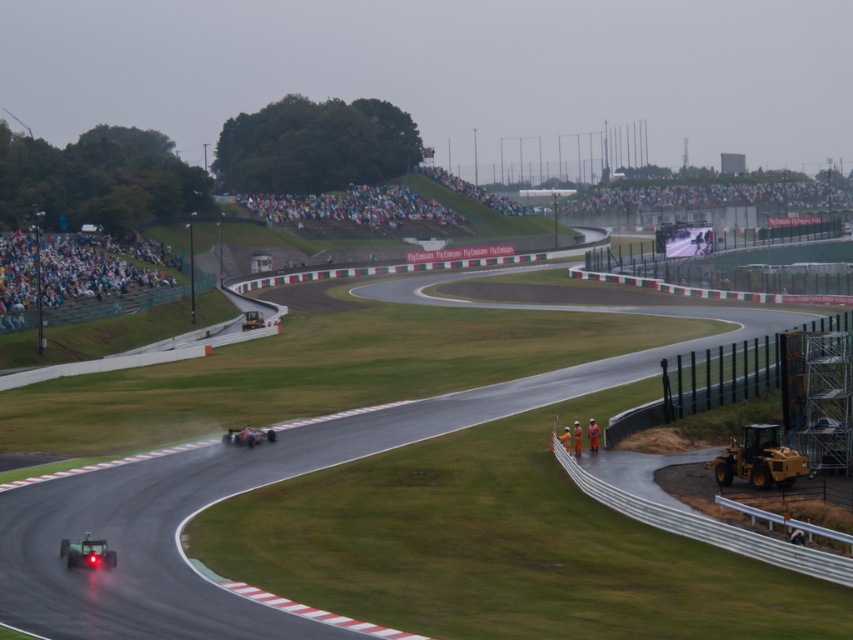
You are a race car driver preparing to enter the smooth asphalt race track at center from the yellow metallic race car at lower right. Considering the track and car widths, can your car safely navigate the track without touching the edges?

The smooth asphalt race track at center is wider than the yellow metallic race car at lower right, so yes, the car can safely navigate the track without touching the edges.

You are a race car driver who just passed the yellow metallic race car at lower right. You want to know if you can safely overtake the next car ahead on the smooth asphalt race track at center. Given that your car requires at least 30 feet of clear track to perform a safe overtake, can you do it?

The distance between the yellow metallic race car at lower right and the smooth asphalt race track at center is 33.76 feet, which is more than the required 30 feet. Therefore, you can safely overtake the next car ahead on the smooth asphalt race track at center.

You are a race car driver preparing for a pit stop. You need to know if your shiny metallic race car at center can fit entirely on the smooth asphalt race track at center without any part hanging off. Based on the scene description, can it?

The smooth asphalt race track at center has a larger size compared to the shiny metallic race car at center, so the car can fit entirely on the track without any part hanging off.